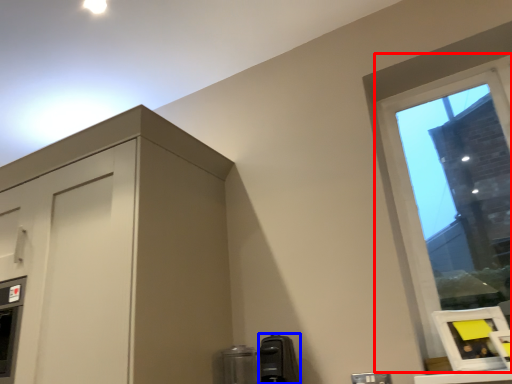
Question: Among these objects, which one is nearest to the camera, window (highlighted by a red box) or appliance (highlighted by a blue box)?

Choices:
 (A) window
 (B) appliance

Answer: (A)